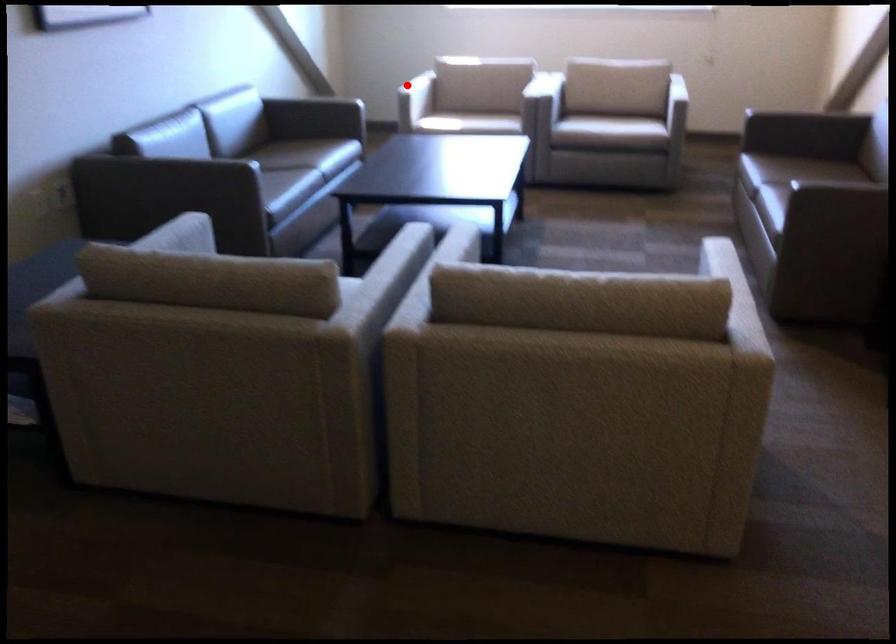
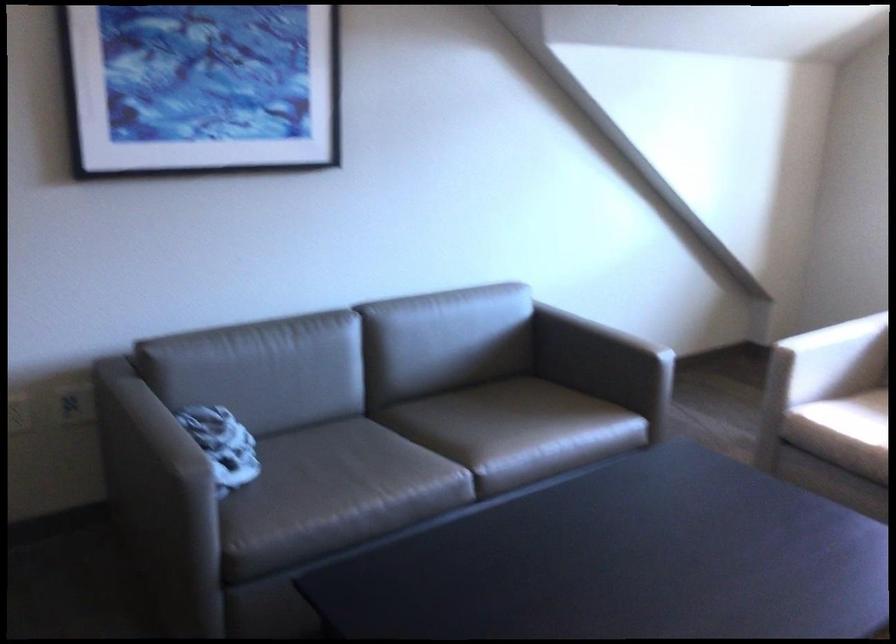
The point at the highlighted location is marked in the first image. Where is the corresponding point in the second image?

(831, 359)